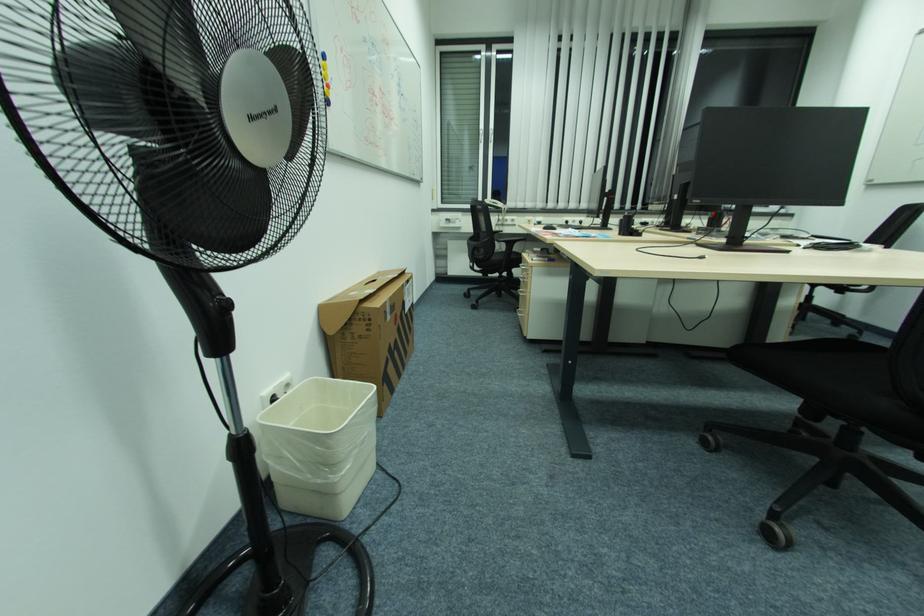
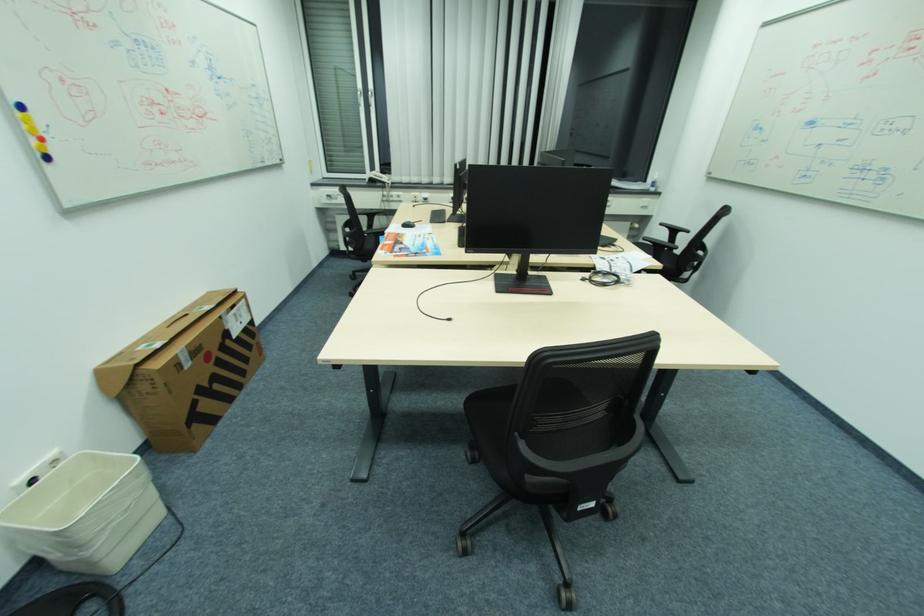
Where in the second image is the point corresponding to (x=451, y=267) from the first image?

(343, 241)